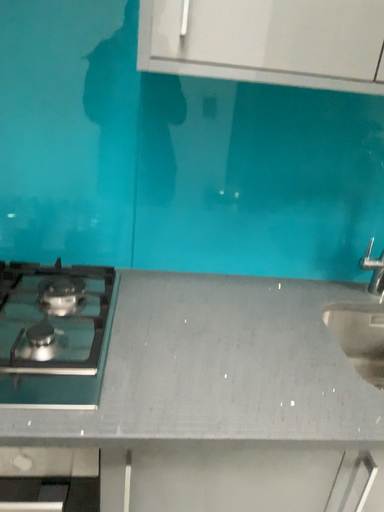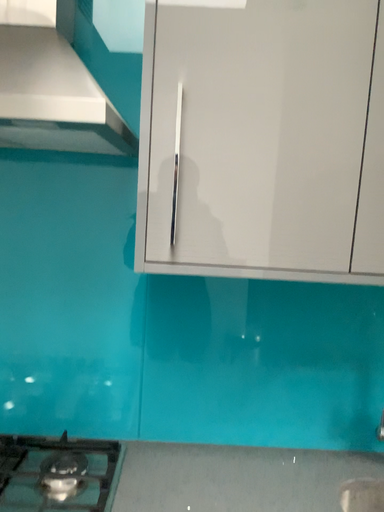
Question: Which way did the camera rotate in the video?

Choices:
 (A) rotated downward
 (B) rotated upward

Answer: (B)